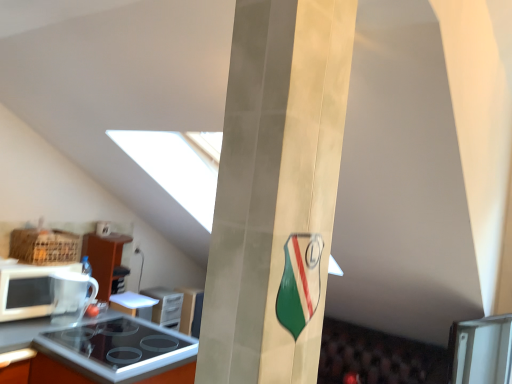
Question: Is white glossy plate at lower center, arranged as the second appliance when viewed from the back, looking in the opposite direction of black glass stove at lower left, which is counted as the third appliance, starting from the front?

Choices:
 (A) no
 (B) yes

Answer: (A)

Question: Is white glossy plate at lower center, arranged as the second appliance when viewed from the front, far from black glass stove at lower left, which is the 1th appliance from back to front?

Choices:
 (A) no
 (B) yes

Answer: (A)

Question: From a real-world perspective, is white glossy plate at lower center, arranged as the second appliance when viewed from the front, located beneath black glass stove at lower left, which is the 1th appliance from back to front?

Choices:
 (A) yes
 (B) no

Answer: (B)

Question: Considering the relative sizes of white glossy plate at lower center, arranged as the second appliance when viewed from the back, and black glass stove at lower left, which is counted as the third appliance, starting from the front, in the image provided, is white glossy plate at lower center, arranged as the second appliance when viewed from the back, wider than black glass stove at lower left, which is counted as the third appliance, starting from the front,?

Choices:
 (A) no
 (B) yes

Answer: (B)

Question: Considering the relative sizes of white glossy plate at lower center, arranged as the second appliance when viewed from the back, and black glass stove at lower left, which is the 1th appliance from back to front, in the image provided, is white glossy plate at lower center, arranged as the second appliance when viewed from the back, shorter than black glass stove at lower left, which is the 1th appliance from back to front,?

Choices:
 (A) yes
 (B) no

Answer: (A)

Question: Considering the relative sizes of white glossy plate at lower center, arranged as the second appliance when viewed from the front, and black glass stove at lower left, which is the 1th appliance from back to front, in the image provided, is white glossy plate at lower center, arranged as the second appliance when viewed from the front, taller than black glass stove at lower left, which is the 1th appliance from back to front,?

Choices:
 (A) no
 (B) yes

Answer: (A)

Question: Is the surface of transparent glass mug at lower left, acting as the third appliance starting from the back, in direct contact with white glossy plate at lower center, arranged as the second appliance when viewed from the back?

Choices:
 (A) yes
 (B) no

Answer: (B)

Question: Is transparent glass mug at lower left, placed as the 1th appliance when sorted from front to back, thinner than white glossy plate at lower center, arranged as the second appliance when viewed from the front?

Choices:
 (A) no
 (B) yes

Answer: (B)

Question: Is white glossy plate at lower center, arranged as the second appliance when viewed from the back, surrounded by transparent glass mug at lower left, placed as the 1th appliance when sorted from front to back?

Choices:
 (A) yes
 (B) no

Answer: (B)

Question: From a real-world perspective, is transparent glass mug at lower left, placed as the 1th appliance when sorted from front to back, located higher than white glossy plate at lower center, arranged as the second appliance when viewed from the front?

Choices:
 (A) yes
 (B) no

Answer: (A)

Question: Considering the relative sizes of transparent glass mug at lower left, placed as the 1th appliance when sorted from front to back, and white glossy plate at lower center, arranged as the second appliance when viewed from the front, in the image provided, is transparent glass mug at lower left, placed as the 1th appliance when sorted from front to back, shorter than white glossy plate at lower center, arranged as the second appliance when viewed from the front,?

Choices:
 (A) yes
 (B) no

Answer: (B)

Question: Could you tell me if transparent glass mug at lower left, placed as the 1th appliance when sorted from front to back, is turned towards white glossy plate at lower center, arranged as the second appliance when viewed from the front?

Choices:
 (A) no
 (B) yes

Answer: (A)

Question: Considering the relative positions of orange laminate countertop at lower left and matte gold pillar at center in the image provided, is orange laminate countertop at lower left to the left of matte gold pillar at center from the viewer's perspective?

Choices:
 (A) no
 (B) yes

Answer: (B)